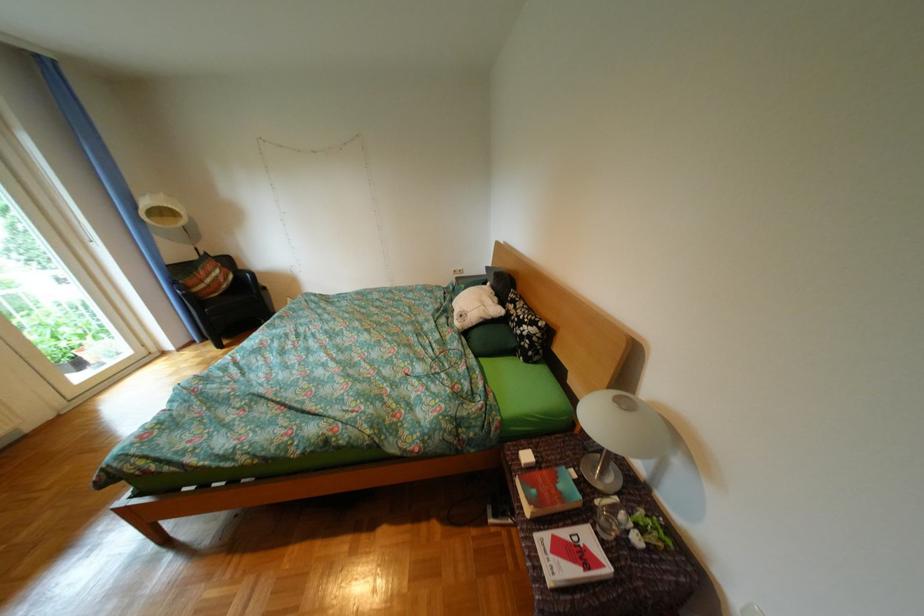
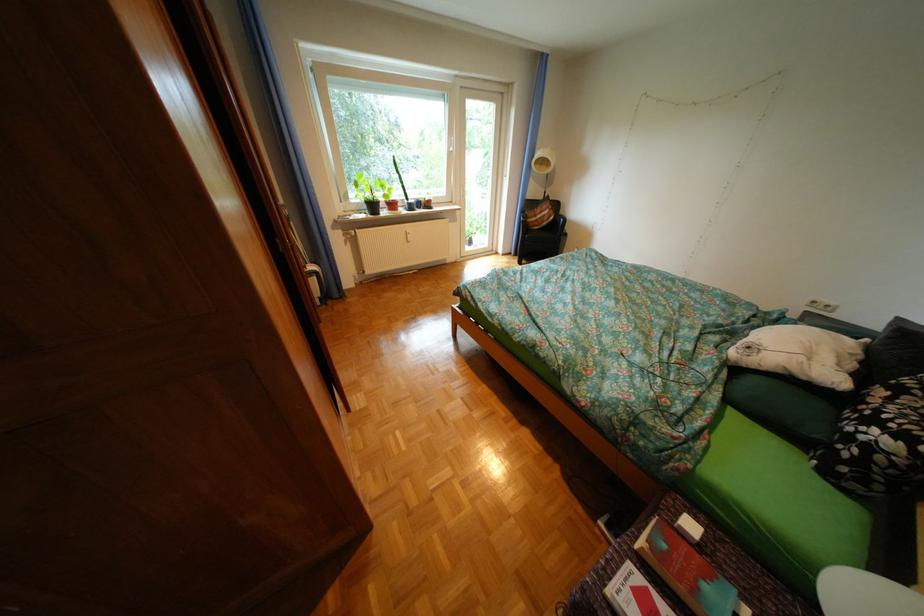
Find the pixel in the second image that matches point (554, 524) in the first image.

(658, 565)